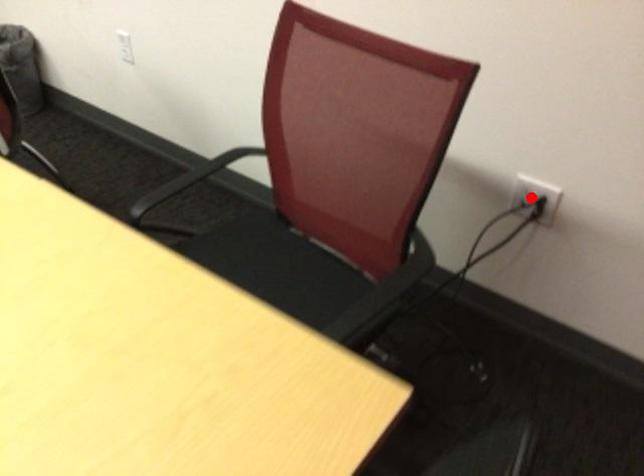
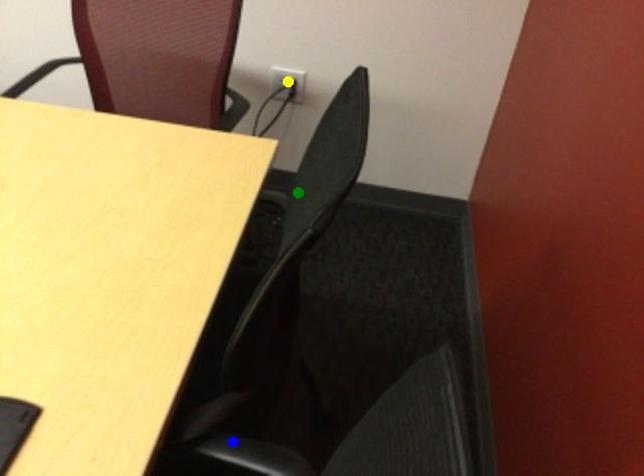
Question: I am providing you with two images of the same scene from different viewpoints. A red point is marked on the first image. You are given multiple points on the second image. Which mark in image 2 goes with the point in image 1?

Choices:
 (A) yellow point
 (B) blue point
 (C) green point

Answer: (A)